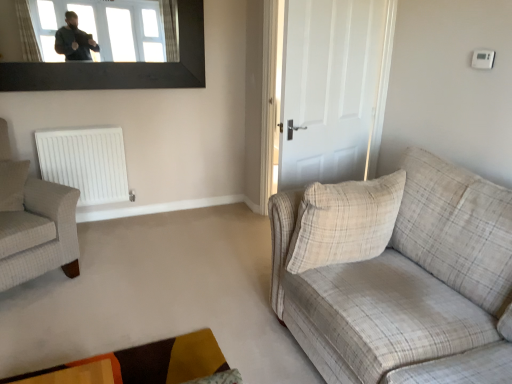
What do you see at coordinates (34, 222) in the screenshot? I see `plaid fabric armchair at left` at bounding box center [34, 222].

The height and width of the screenshot is (384, 512). Find the location of `transparent glass window at upper center`. transparent glass window at upper center is located at coordinates (111, 28).

Describe the element at coordinates (333, 88) in the screenshot. The image size is (512, 384). I see `white matte door at center` at that location.

What do you see at coordinates (146, 365) in the screenshot? I see `velvet-like brown and orange rug at lower center` at bounding box center [146, 365].

At what (x,y) coordinates should I click in order to perform the action: click on beige plaid pillow at right, placed as the second pillow when sorted from left to right. Please return your answer as a coordinate pair (x, y). Looking at the image, I should click on (345, 222).

Identify the location of plaid fabric armchair at left. Image resolution: width=512 pixels, height=384 pixels. (34, 222).

Which is in front, beige plaid pillow at right, which appears as the 2th pillow when viewed from the back, or velvet-like brown and orange rug at lower center?

velvet-like brown and orange rug at lower center is in front.

Are beige plaid pillow at right, placed as the first pillow when sorted from front to back, and velvet-like brown and orange rug at lower center beside each other?

No, beige plaid pillow at right, placed as the first pillow when sorted from front to back, is not touching velvet-like brown and orange rug at lower center.

Which is more to the right, beige plaid pillow at right, placed as the second pillow when sorted from left to right, or velvet-like brown and orange rug at lower center?

beige plaid pillow at right, placed as the second pillow when sorted from left to right, is more to the right.

Can you tell me how much beige plaid pillow at right, placed as the second pillow when sorted from left to right, and velvet-like brown and orange rug at lower center differ in facing direction?

90.2 degrees.

From the image's perspective, is velvet-like brown and orange rug at lower center over beige plaid pillow at left, which is counted as the 1th pillow, starting from the back?

Actually, velvet-like brown and orange rug at lower center appears below beige plaid pillow at left, which is counted as the 1th pillow, starting from the back, in the image.

Can you confirm if velvet-like brown and orange rug at lower center is positioned to the right of beige plaid pillow at left, which is counted as the 1th pillow, starting from the back?

Correct, you'll find velvet-like brown and orange rug at lower center to the right of beige plaid pillow at left, which is counted as the 1th pillow, starting from the back.

Measure the distance from velvet-like brown and orange rug at lower center to beige plaid pillow at left, the 2th pillow from the right.

velvet-like brown and orange rug at lower center is 1.42 meters from beige plaid pillow at left, the 2th pillow from the right.

Between velvet-like brown and orange rug at lower center and beige plaid pillow at left, positioned as the second pillow in front-to-back order, which one has more height?

Standing taller between the two is beige plaid pillow at left, positioned as the second pillow in front-to-back order.

From the picture: Is beige plaid pillow at left, positioned as the second pillow in front-to-back order, at the back of transparent glass window at upper center?

No, beige plaid pillow at left, positioned as the second pillow in front-to-back order, is not at the back of transparent glass window at upper center.

Measure the distance between transparent glass window at upper center and beige plaid pillow at left, which is the first pillow in left-to-right order.

1.18 meters.

From the image's perspective, does transparent glass window at upper center appear higher than beige plaid pillow at left, the 2th pillow from the right?

Indeed, from the image's perspective, transparent glass window at upper center is shown above beige plaid pillow at left, the 2th pillow from the right.

I want to click on the 1st pillow below when counting from the transparent glass window at upper center (from the image's perspective), so click(x=13, y=184).

Is white matte radiator at left positioned far away from beige plaid pillow at right, placed as the first pillow when sorted from front to back?

Yes, white matte radiator at left is far from beige plaid pillow at right, placed as the first pillow when sorted from front to back.

Consider the image. How different are the orientations of white matte radiator at left and beige plaid pillow at right, acting as the first pillow starting from the right, in degrees?

0.657 degrees separate the facing orientations of white matte radiator at left and beige plaid pillow at right, acting as the first pillow starting from the right.

From the image's perspective, which one is positioned lower, white matte radiator at left or beige plaid pillow at right, placed as the first pillow when sorted from front to back?

beige plaid pillow at right, placed as the first pillow when sorted from front to back, from the image's perspective.

In the scene shown: Looking at their sizes, would you say white matte radiator at left is wider or thinner than beige plaid pillow at right, which appears as the 2th pillow when viewed from the back?

white matte radiator at left is thinner than beige plaid pillow at right, which appears as the 2th pillow when viewed from the back.

Considering the relative sizes of beige plaid fabric couch at right and white matte door at center in the image provided, is beige plaid fabric couch at right bigger than white matte door at center?

Indeed, beige plaid fabric couch at right has a larger size compared to white matte door at center.

Can you tell me how much beige plaid fabric couch at right and white matte door at center differ in facing direction?

The facing directions of beige plaid fabric couch at right and white matte door at center are 70.8 degrees apart.

Which object is thinner, beige plaid fabric couch at right or white matte door at center?

white matte door at center.

From a real-world perspective, between beige plaid fabric couch at right and white matte door at center, who is vertically higher?

In real-world perspective, white matte door at center is above.

In the scene shown: Does beige plaid pillow at right, placed as the first pillow when sorted from front to back, have a lesser width compared to white matte door at center?

Incorrect, the width of beige plaid pillow at right, placed as the first pillow when sorted from front to back, is not less than that of white matte door at center.

From a real-world perspective, which object rests below the other?

From a 3D spatial view, beige plaid pillow at right, placed as the second pillow when sorted from left to right, is below.

Where is `pillow located in front of the white matte door at center`? pillow located in front of the white matte door at center is located at coordinates (345, 222).

Is velvet-like brown and orange rug at lower center in contact with white matte door at center?

velvet-like brown and orange rug at lower center is not next to white matte door at center, and they're not touching.

Which object is thinner, velvet-like brown and orange rug at lower center or white matte door at center?

With smaller width is white matte door at center.

Where is `plain in front of the white matte door at center`? The image size is (512, 384). plain in front of the white matte door at center is located at coordinates (146, 365).

Is point (126, 371) closer or farther from the camera than point (341, 41)?

Clearly, point (126, 371) is closer to the camera than point (341, 41).

From a real-world perspective, starting from the velvet-like brown and orange rug at lower center, which pillow is the 2nd one vertically above it? Please provide its 2D coordinates.

[(345, 222)]

Find the location of a particular element. plain located on the right of beige plaid pillow at left, which is the first pillow in left-to-right order is located at coordinates (146, 365).

Consider the image. When comparing their distances from beige plaid pillow at left, positioned as the second pillow in front-to-back order, does beige plaid fabric couch at right or transparent glass window at upper center seem further?

Based on the image, beige plaid fabric couch at right appears to be further to beige plaid pillow at left, positioned as the second pillow in front-to-back order.

From the image, which object appears to be nearer to beige plaid fabric couch at right, transparent glass window at upper center or velvet-like brown and orange rug at lower center?

Among the two, velvet-like brown and orange rug at lower center is located nearer to beige plaid fabric couch at right.

Considering their positions, is white matte door at center positioned further to velvet-like brown and orange rug at lower center than beige plaid pillow at right, placed as the second pillow when sorted from left to right?

white matte door at center lies further to velvet-like brown and orange rug at lower center than the other object.

From the image, which object appears to be nearer to plaid fabric armchair at left, beige plaid fabric couch at right or beige plaid pillow at left, positioned as the second pillow in front-to-back order?

The object closer to plaid fabric armchair at left is beige plaid pillow at left, positioned as the second pillow in front-to-back order.

Looking at this image, from the image, which object appears to be farther from white matte radiator at left, beige plaid pillow at right, placed as the first pillow when sorted from front to back, or plaid fabric armchair at left?

beige plaid pillow at right, placed as the first pillow when sorted from front to back, is further to white matte radiator at left.

From the image, which object appears to be farther from transparent glass window at upper center, plaid fabric armchair at left or beige plaid fabric couch at right?

Among the two, beige plaid fabric couch at right is located further to transparent glass window at upper center.

When comparing their distances from white matte door at center, does beige plaid fabric couch at right or beige plaid pillow at right, which appears as the 2th pillow when viewed from the back, seem further?

beige plaid fabric couch at right.

From the image, which object appears to be nearer to white matte door at center, plaid fabric armchair at left or velvet-like brown and orange rug at lower center?

velvet-like brown and orange rug at lower center is closer to white matte door at center.

This screenshot has height=384, width=512. I want to click on radiator between transparent glass window at upper center and beige plaid pillow at left, which is counted as the 1th pillow, starting from the back, vertically, so click(x=86, y=163).

Where is `window situated between white matte radiator at left and beige plaid pillow at right, placed as the second pillow when sorted from left to right, from left to right`? window situated between white matte radiator at left and beige plaid pillow at right, placed as the second pillow when sorted from left to right, from left to right is located at coordinates (111, 28).

Identify the location of door located between velvet-like brown and orange rug at lower center and beige plaid pillow at right, acting as the first pillow starting from the right, in the left-right direction. Image resolution: width=512 pixels, height=384 pixels. (333, 88).

Where is `door between white matte radiator at left and beige plaid pillow at right, placed as the second pillow when sorted from left to right, from left to right`? door between white matte radiator at left and beige plaid pillow at right, placed as the second pillow when sorted from left to right, from left to right is located at coordinates (333, 88).